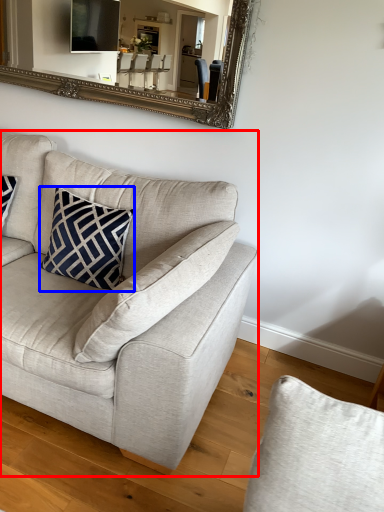
Question: Which of the following is the farthest to the observer, studio couch (highlighted by a red box) or pillow (highlighted by a blue box)?

Choices:
 (A) studio couch
 (B) pillow

Answer: (B)